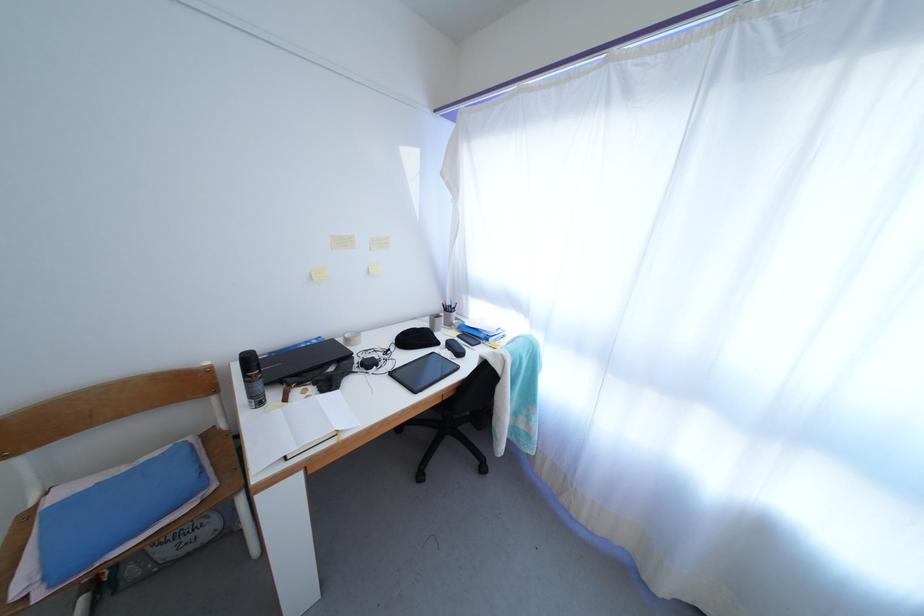
At what (x,y) coordinates should I click in order to perform the action: click on clear tape roll. Please return your answer as a coordinate pair (x, y). This screenshot has height=616, width=924. Looking at the image, I should click on (350, 338).